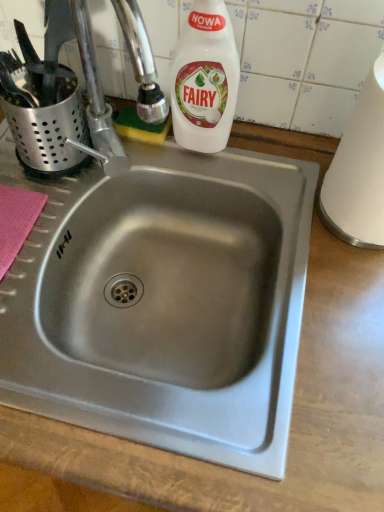
This screenshot has height=512, width=384. I want to click on free space in front of white plastic bottle at upper center, so click(x=216, y=184).